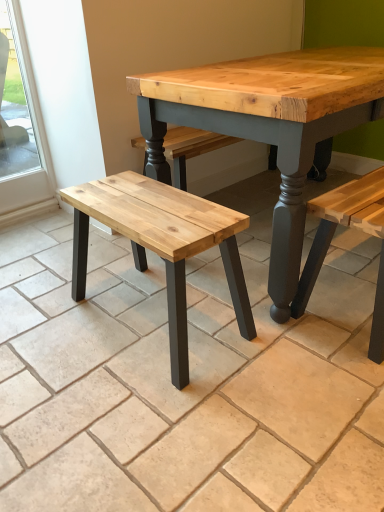
Question: From their relative heights in the image, would you say clear glass window at left is taller or shorter than natural wood bench at left?

Choices:
 (A) tall
 (B) short

Answer: (A)

Question: In the image, is clear glass window at left positioned in front of or behind natural wood bench at left?

Choices:
 (A) behind
 (B) front

Answer: (A)

Question: Based on their relative distances, which object is farther from the clear glass window at left?

Choices:
 (A) natural wood bench at center
 (B) natural wood bench at left

Answer: (B)

Question: Which object is positioned farthest from the natural wood bench at center?

Choices:
 (A) clear glass window at left
 (B) natural wood bench at left

Answer: (A)